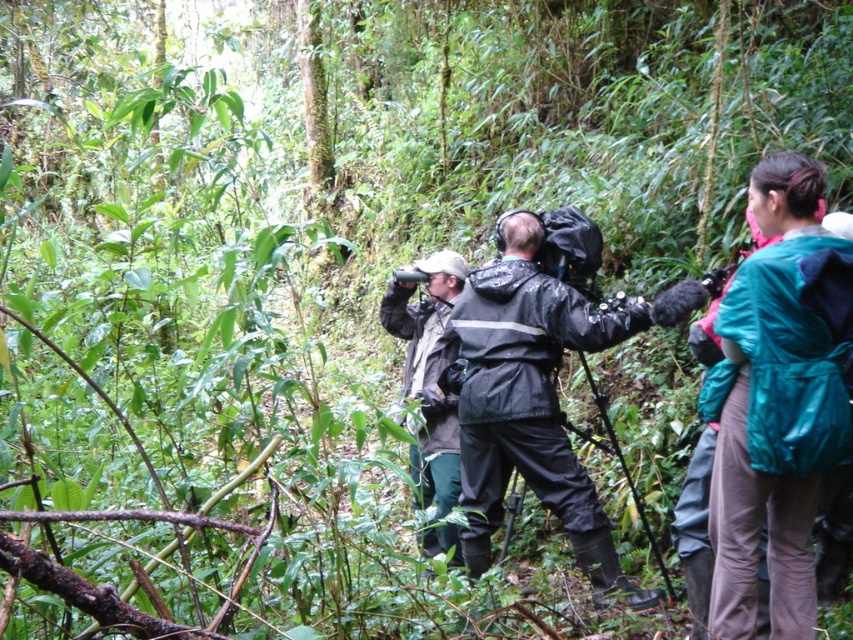
Question: Does teal matte jacket at right appear under waterproof black jacket at center?

Choices:
 (A) no
 (B) yes

Answer: (A)

Question: Which point is farther to the camera?

Choices:
 (A) (761, 179)
 (B) (503, 332)

Answer: (B)

Question: Is teal matte jacket at right closer to the viewer compared to waterproof black jacket at center?

Choices:
 (A) yes
 (B) no

Answer: (A)

Question: Which point is farther from the camera taking this photo?

Choices:
 (A) (778, 288)
 (B) (634, 316)

Answer: (B)

Question: Which of the following is the farthest from the observer?

Choices:
 (A) waterproof black jacket at center
 (B) teal matte jacket at right

Answer: (A)

Question: Can you confirm if teal matte jacket at right is thinner than waterproof black jacket at center?

Choices:
 (A) no
 (B) yes

Answer: (B)